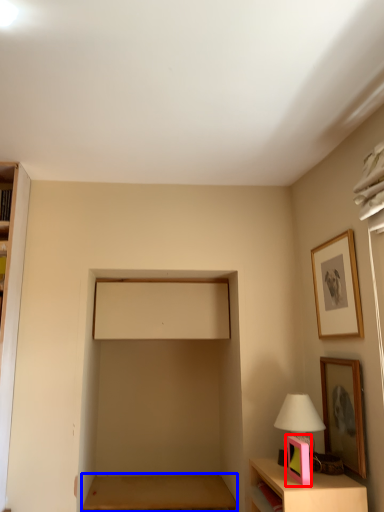
Question: Which point is further to the camera, picture frame (highlighted by a red box) or table (highlighted by a blue box)?

Choices:
 (A) picture frame
 (B) table

Answer: (B)